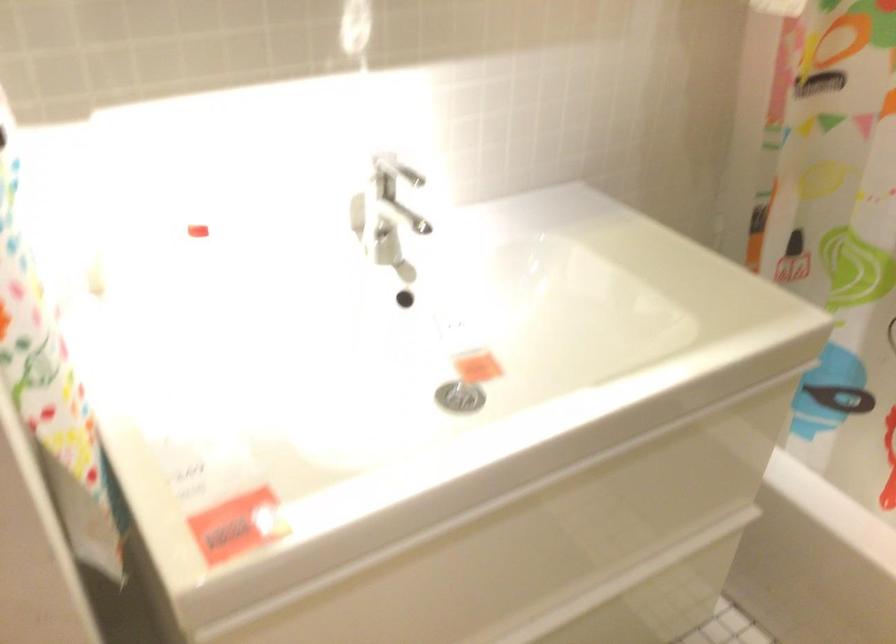
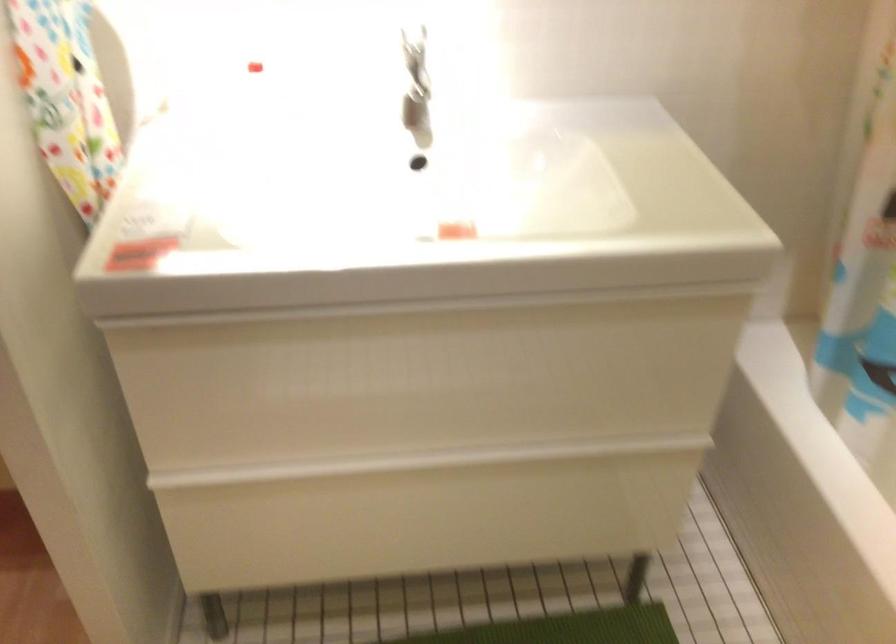
Question: In a continuous first-person perspective shot, in which direction is the camera moving?

Choices:
 (A) Left
 (B) Right
 (C) Forward
 (D) Backward

Answer: (B)